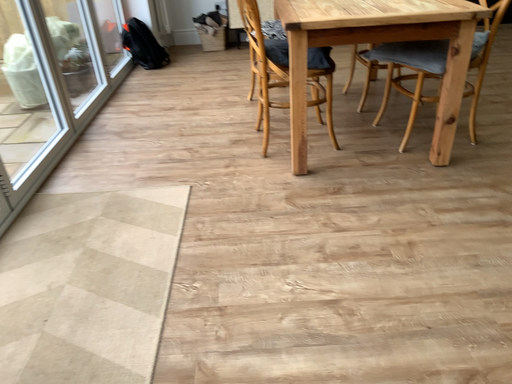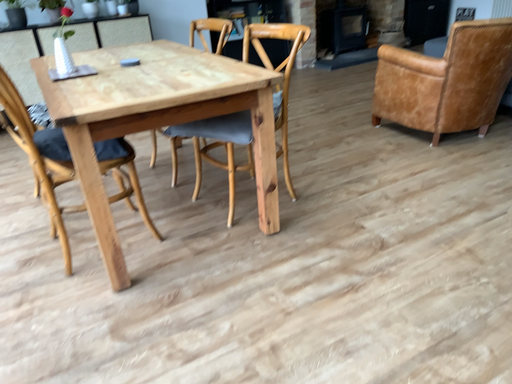
Question: How did the camera likely rotate when shooting the video?

Choices:
 (A) rotated right
 (B) rotated left

Answer: (A)